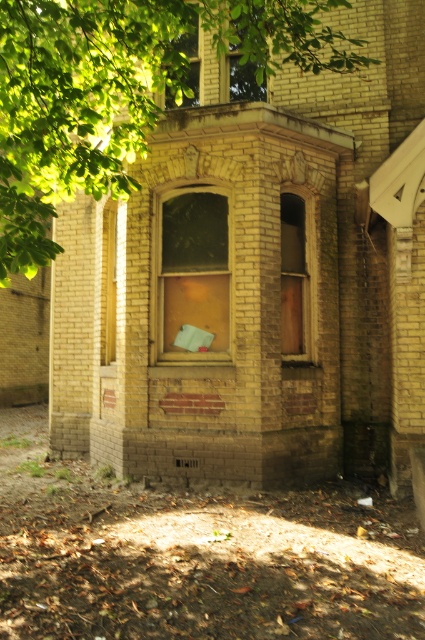
Question: Is translucent glass window at center to the right of yellow brick window at center from the viewer's perspective?

Choices:
 (A) no
 (B) yes

Answer: (B)

Question: Which object is closer to the camera taking this photo?

Choices:
 (A) wooden door at center
 (B) green leafy tree at upper left
 (C) translucent glass window at center
 (D) transparent glass window at upper center

Answer: (B)

Question: Which object is closer to the camera taking this photo?

Choices:
 (A) transparent glass window at upper center
 (B) translucent glass window at center
 (C) wooden frame at upper center

Answer: (B)

Question: In this image, where is wooden door at center located relative to transparent glass window at upper center?

Choices:
 (A) above
 (B) below

Answer: (B)

Question: Which of the following is the farthest from the observer?

Choices:
 (A) transparent glass window at upper center
 (B) wooden frame at upper center
 (C) yellow brick window at center

Answer: (B)

Question: Does green leafy tree at upper left appear under transparent glass window at upper center?

Choices:
 (A) no
 (B) yes

Answer: (B)